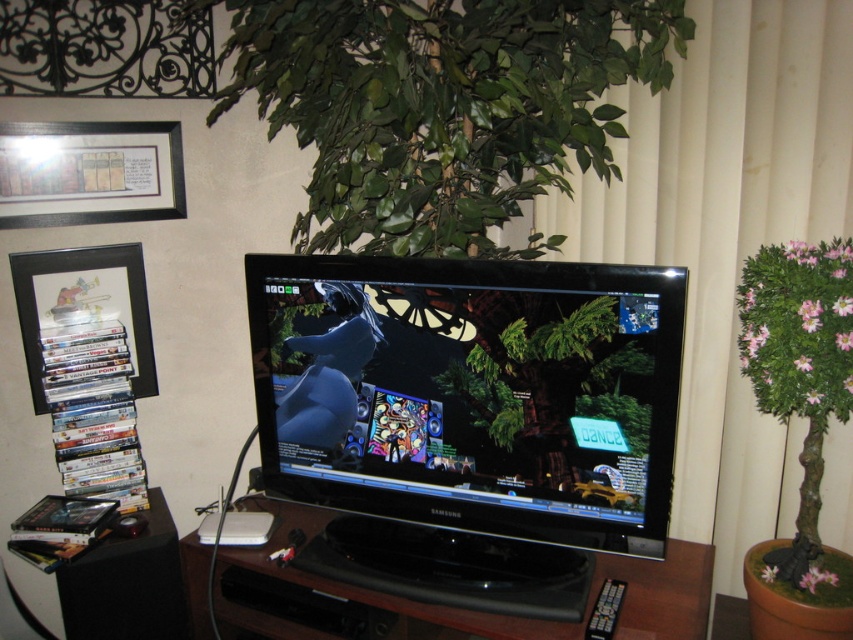
Who is higher up, black matte picture frame at upper left or black plastic picture frame at left?

black matte picture frame at upper left

Who is more forward, (7, 157) or (77, 275)?

Point (7, 157) is more forward.

This screenshot has width=853, height=640. Identify the location of black matte picture frame at upper left. (90, 172).

Does white textured curtain at upper right have a greater width compared to black wood tv stand at center?

No, white textured curtain at upper right is not wider than black wood tv stand at center.

Can you confirm if white textured curtain at upper right is smaller than black wood tv stand at center?

Incorrect, white textured curtain at upper right is not smaller in size than black wood tv stand at center.

Does point (744, 234) come behind point (195, 547)?

No, it is not.

I want to click on white textured curtain at upper right, so click(x=727, y=232).

Does white textured curtain at upper right have a greater height compared to black plastic picture frame at left?

Yes, white textured curtain at upper right is taller than black plastic picture frame at left.

Describe the element at coordinates (727, 232) in the screenshot. I see `white textured curtain at upper right` at that location.

The width and height of the screenshot is (853, 640). I want to click on white textured curtain at upper right, so click(x=727, y=232).